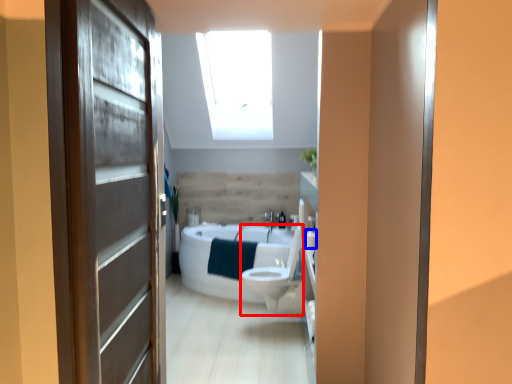
Question: Among these objects, which one is farthest to the camera, toilet bowl (highlighted by a red box) or toilet paper (highlighted by a blue box)?

Choices:
 (A) toilet bowl
 (B) toilet paper

Answer: (A)